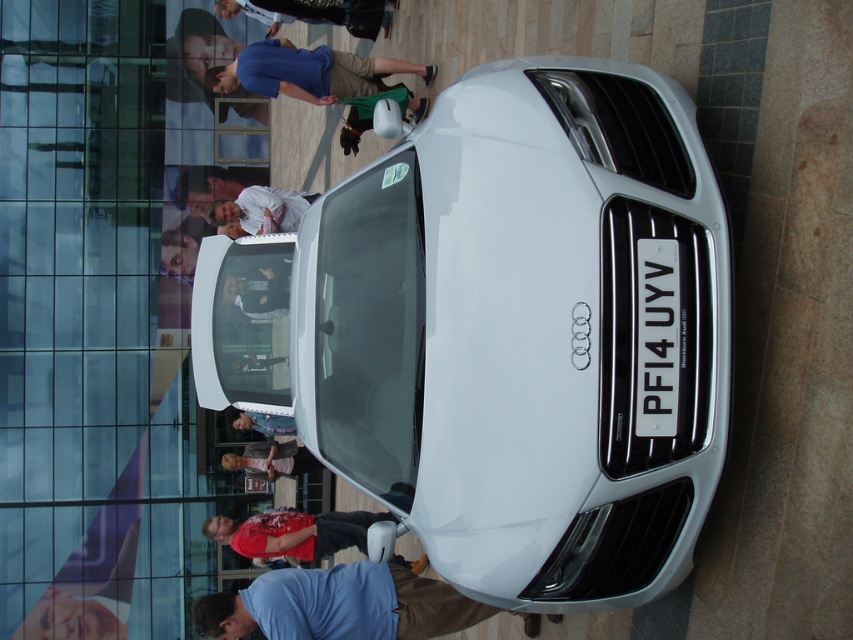
In the scene shown: You are standing in front of the white Audi car parked near the glass building. There are two points marked on the pavement. The first point is at coordinates point [271,65] and the second at point [126,593]. Which point is closer to you?

Point [271,65] is closer to the camera than point [126,593], so the first point is closer to you.

You are standing in front of the white Audi car parked near the glass building. There are two points marked on the pavement. One is at coordinate point(376, 632) and the other at point(68, 620). Which point is closer to you?

Point(376, 632) is closer to the camera than point(68, 620), so the point at coordinate point(376, 632) is closer to you.